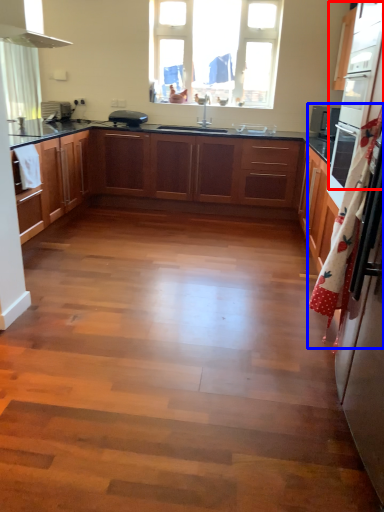
Question: Among these objects, which one is farthest to the camera, oven (highlighted by a red box) or curtain (highlighted by a blue box)?

Choices:
 (A) oven
 (B) curtain

Answer: (A)